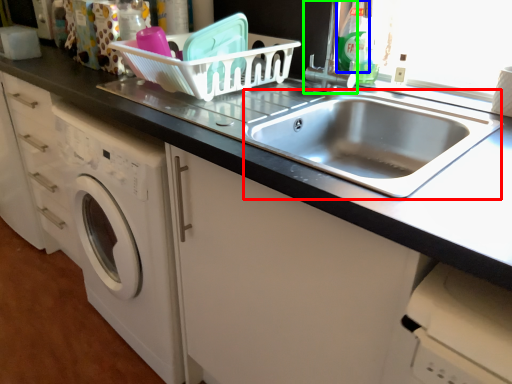
Question: Which is farther away from sink (highlighted by a red box)? cleaning product (highlighted by a blue box) or faucet (highlighted by a green box)?

Choices:
 (A) cleaning product
 (B) faucet

Answer: (A)